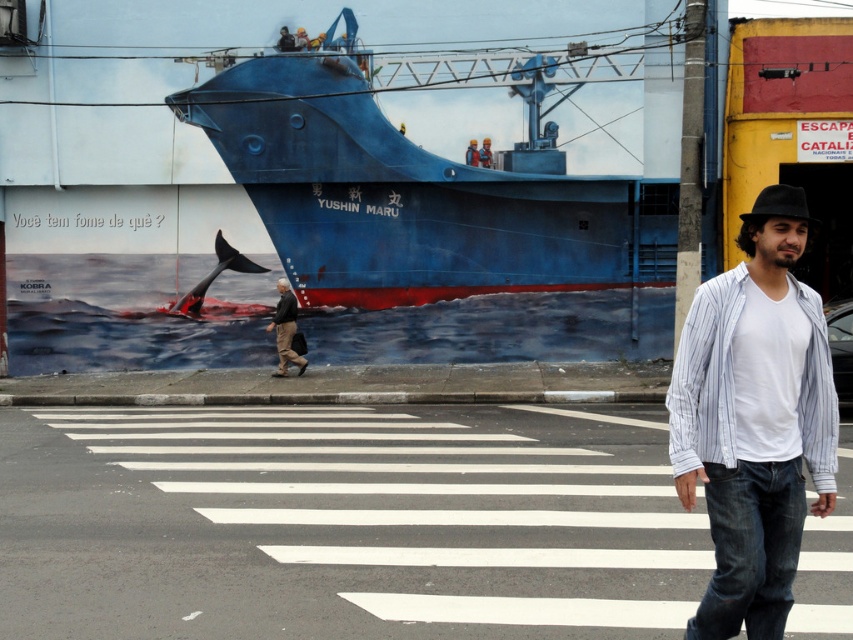
Question: Is blue matte ship at center closer to camera compared to white cotton shirt at center?

Choices:
 (A) no
 (B) yes

Answer: (A)

Question: Which of the following is the closest to the observer?

Choices:
 (A) brown leather jacket at center
 (B) blue matte ship at center
 (C) white cotton shirt at center

Answer: (C)

Question: Can you confirm if blue matte ship at center is thinner than white cotton shirt at center?

Choices:
 (A) yes
 (B) no

Answer: (A)

Question: Observing the image, what is the correct spatial positioning of white cotton shirt at center in reference to brown leather jacket at center?

Choices:
 (A) left
 (B) right

Answer: (B)

Question: Which object appears farthest from the camera in this image?

Choices:
 (A) blue matte ship at center
 (B) white cotton shirt at center

Answer: (A)

Question: Which point is farther to the camera?

Choices:
 (A) blue matte ship at center
 (B) white cotton shirt at center

Answer: (A)